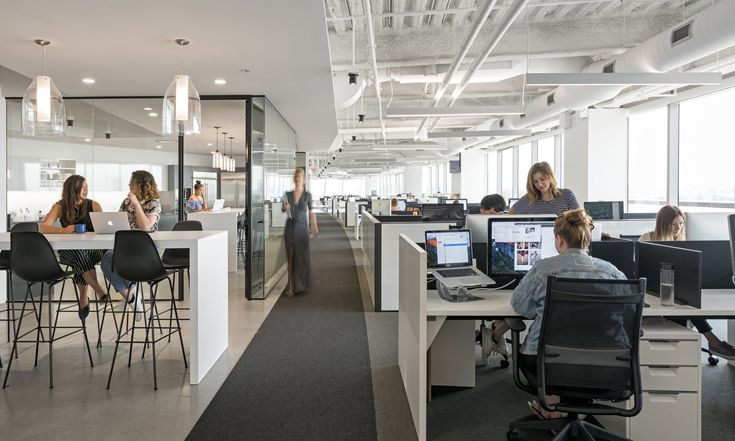
This screenshot has width=735, height=441. I want to click on desk, so click(x=226, y=261), click(x=223, y=223), click(x=415, y=296), click(x=373, y=225), click(x=351, y=210), click(x=337, y=205), click(x=329, y=200), click(x=318, y=196).